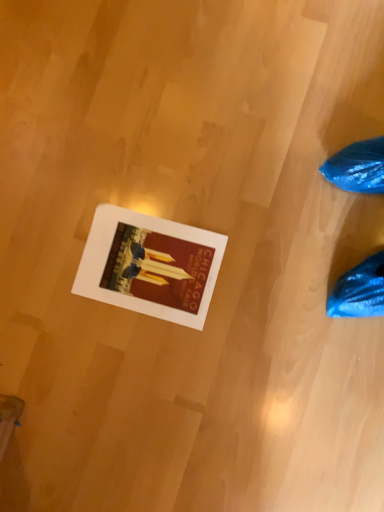
Identify the location of vacant space situated above white matte picture frame at lower left (from a real-world perspective). (146, 265).